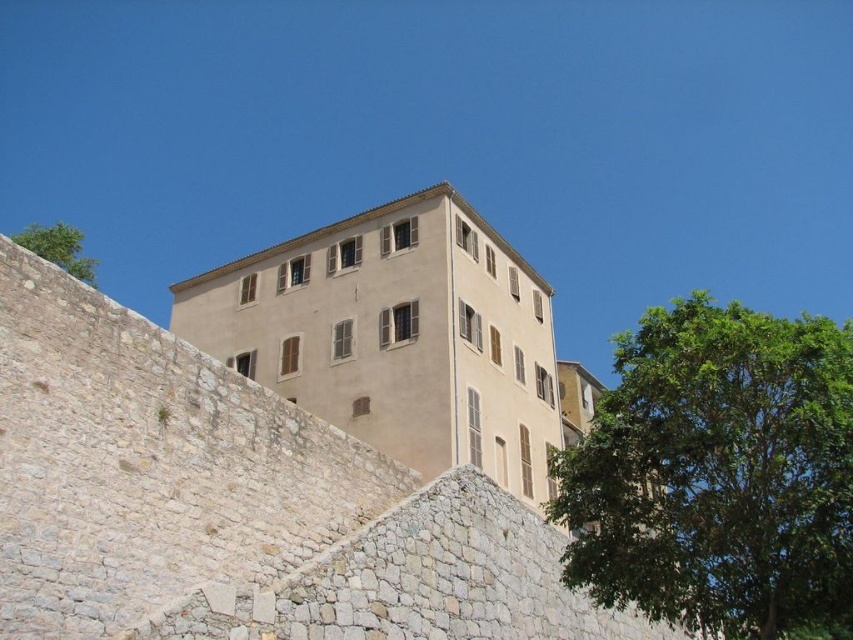
Question: Estimate the real-world distances between objects in this image. Which object is closer to the green leafy tree at upper left?

Choices:
 (A) green leafy tree at right
 (B) beige matte building at center

Answer: (B)

Question: Does beige stone wall at center appear under beige matte building at center?

Choices:
 (A) yes
 (B) no

Answer: (A)

Question: Which is nearer to the green leafy tree at upper left?

Choices:
 (A) beige stone wall at center
 (B) green leafy tree at right

Answer: (A)

Question: Can you confirm if beige matte building at center is positioned below green leafy tree at upper left?

Choices:
 (A) no
 (B) yes

Answer: (B)

Question: Can you confirm if green leafy tree at right is positioned to the right of green leafy tree at upper left?

Choices:
 (A) no
 (B) yes

Answer: (B)

Question: Which object is the closest to the green leafy tree at upper left?

Choices:
 (A) green leafy tree at right
 (B) beige stone wall at center
 (C) beige matte building at center

Answer: (C)